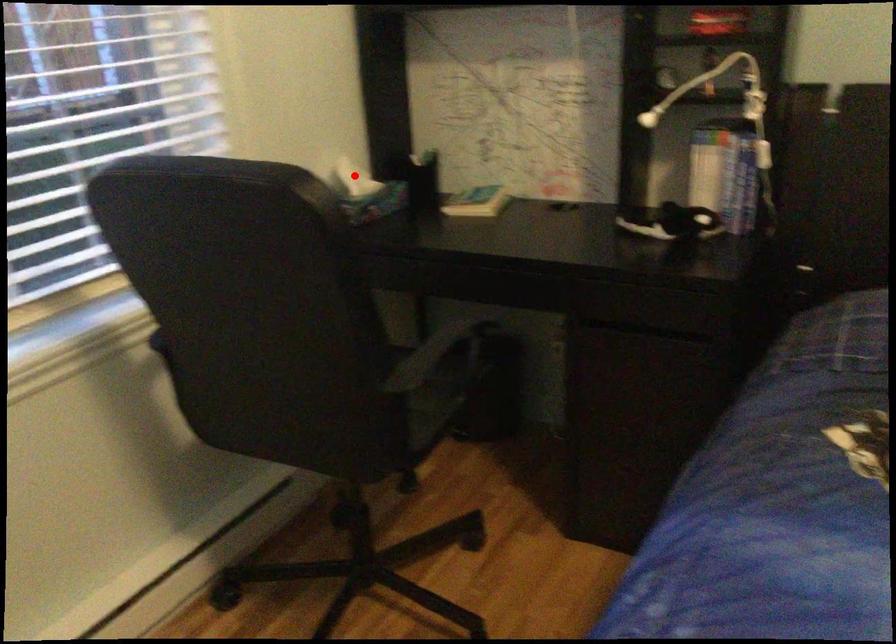
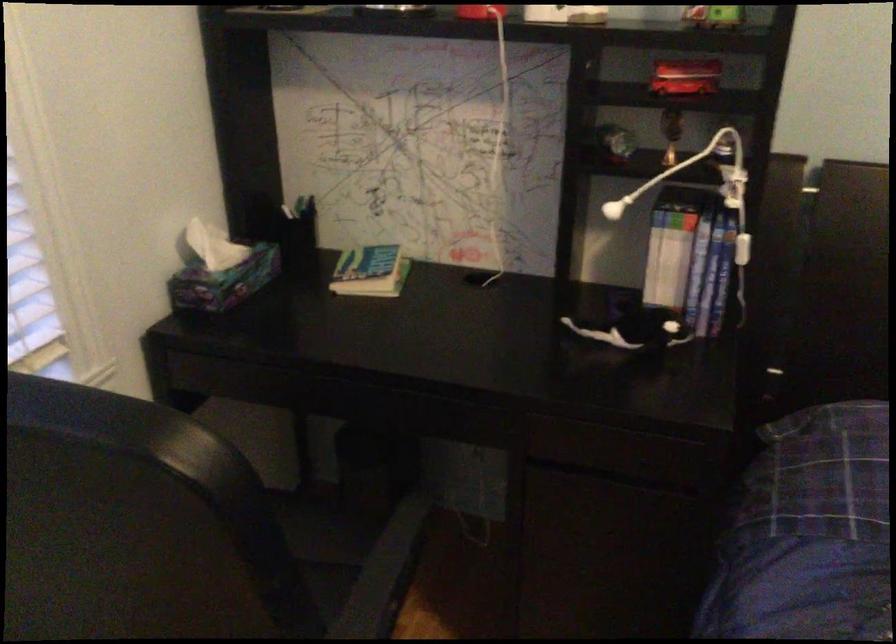
Question: I am providing you with two images of the same scene from different viewpoints. Given a red point in image1, look at the same physical point in image2. Is it:

Choices:
 (A) Closer to the viewpoint
 (B) Farther from the viewpoint

Answer: (A)